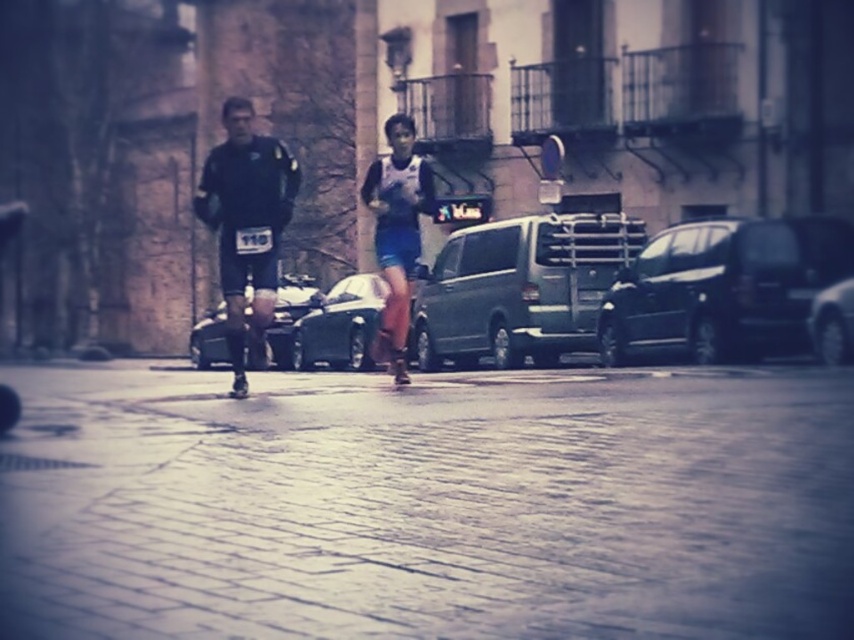
You are a runner in the race and you need to place a marker at point (724, 288). What object should you place the marker on?

The dark gray metallic van at right is located at point (724, 288), so you should place the marker there.

From the picture: You are a photographer trying to capture the dark blue athletic wear at center and the shiny black car at center in the same frame. Based on their positions, which object is closer to the camera?

The dark blue athletic wear at center is located above the shiny black car at center, so it is closer to the camera.

You are a photographer standing at the starting line of the race. You want to take a photo that includes both the point at (736, 300) and the point at (401, 381). Which point should you focus on first to ensure both are in sharp focus?

You should focus on the point at (401, 381) first because it is closer to you than the point at (736, 300), which is further away. By focusing on the closer point, the further point will also be within the depth of field.